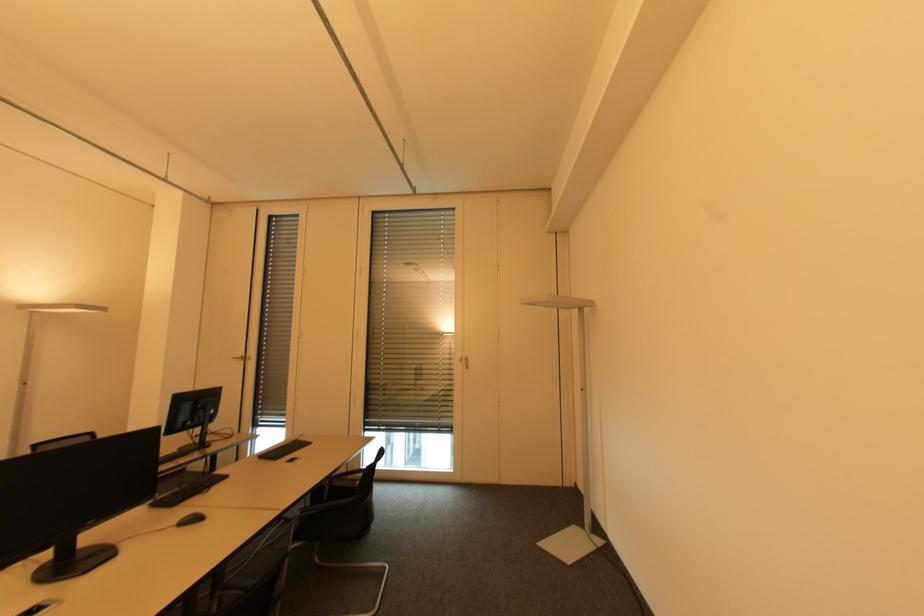
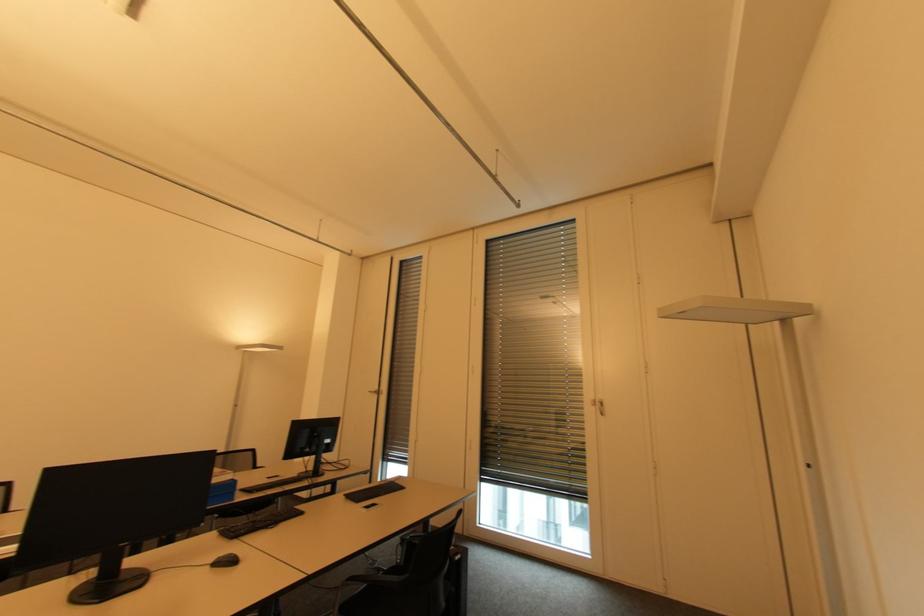
The point at (151, 506) is marked in the first image. Where is the corresponding point in the second image?

(221, 532)